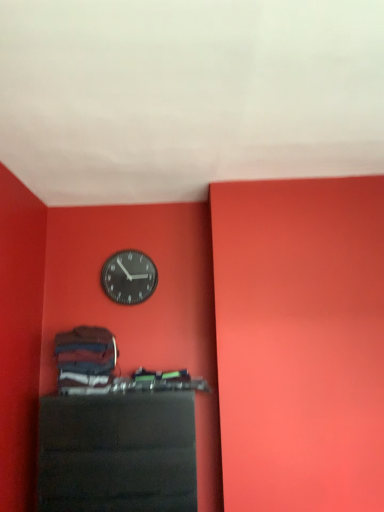
Question: Does metallic black clock at upper center appear on the right side of black glossy shelf at lower center?

Choices:
 (A) yes
 (B) no

Answer: (B)

Question: Is metallic black clock at upper center with black glossy shelf at lower center?

Choices:
 (A) yes
 (B) no

Answer: (B)

Question: Can you confirm if metallic black clock at upper center is positioned to the left of black glossy shelf at lower center?

Choices:
 (A) no
 (B) yes

Answer: (B)

Question: From a real-world perspective, is metallic black clock at upper center physically above black glossy shelf at lower center?

Choices:
 (A) no
 (B) yes

Answer: (B)

Question: From the image's perspective, is metallic black clock at upper center located beneath black glossy shelf at lower center?

Choices:
 (A) yes
 (B) no

Answer: (B)

Question: From the image's perspective, is metallic black clock at upper center on black glossy shelf at lower center?

Choices:
 (A) yes
 (B) no

Answer: (A)

Question: Is black glossy shelf at lower center to the right of metallic black clock at upper center from the viewer's perspective?

Choices:
 (A) no
 (B) yes

Answer: (B)

Question: Is the depth of black glossy shelf at lower center less than that of metallic black clock at upper center?

Choices:
 (A) yes
 (B) no

Answer: (A)

Question: From a real-world perspective, is black glossy shelf at lower center below metallic black clock at upper center?

Choices:
 (A) no
 (B) yes

Answer: (B)

Question: Is black glossy shelf at lower center positioned beyond the bounds of metallic black clock at upper center?

Choices:
 (A) yes
 (B) no

Answer: (A)

Question: Considering the relative sizes of black glossy shelf at lower center and metallic black clock at upper center in the image provided, is black glossy shelf at lower center bigger than metallic black clock at upper center?

Choices:
 (A) no
 (B) yes

Answer: (B)

Question: Is black glossy shelf at lower center positioned behind metallic black clock at upper center?

Choices:
 (A) yes
 (B) no

Answer: (B)

Question: From the image's perspective, is black glossy shelf at lower center above or below metallic black clock at upper center?

Choices:
 (A) above
 (B) below

Answer: (B)